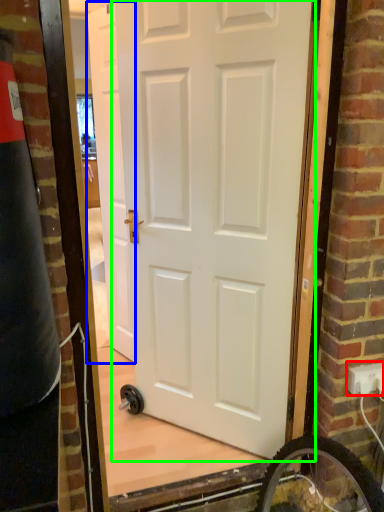
Question: Considering the real-world distances, which object is closest to electric outlet (highlighted by a red box)? door (highlighted by a blue box) or door (highlighted by a green box).

Choices:
 (A) door
 (B) door

Answer: (B)